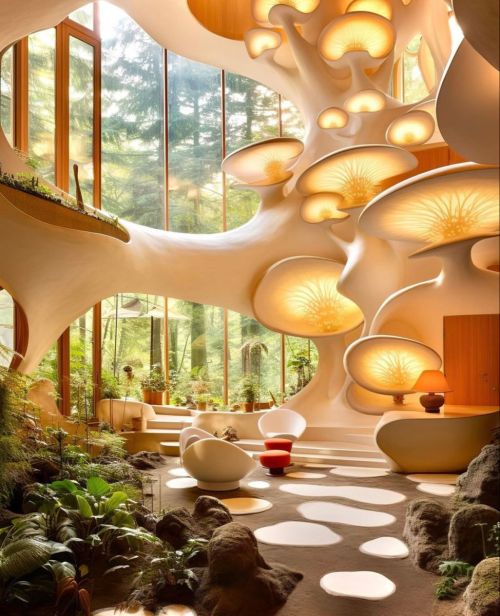
Identify the location of egg chairs. The image size is (500, 616). (290, 419), (198, 430), (213, 460).